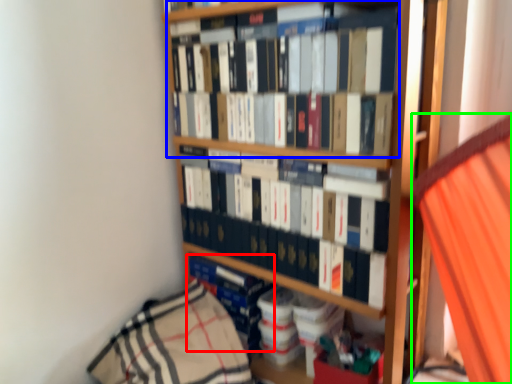
Question: Based on their relative distances, which object is nearer to book (highlighted by a red box)? Choose from book (highlighted by a blue box) and curtain (highlighted by a green box).

Choices:
 (A) book
 (B) curtain

Answer: (A)